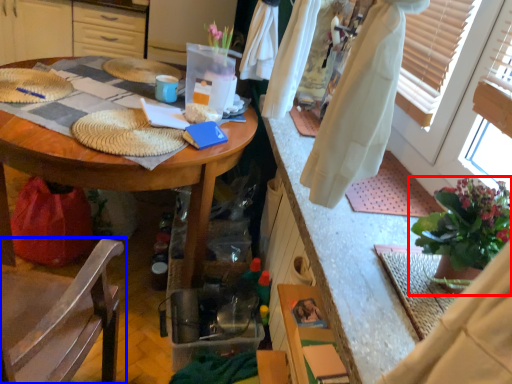
Question: Which of the following is the closest to the observer, houseplant (highlighted by a red box) or chair (highlighted by a blue box)?

Choices:
 (A) houseplant
 (B) chair

Answer: (B)